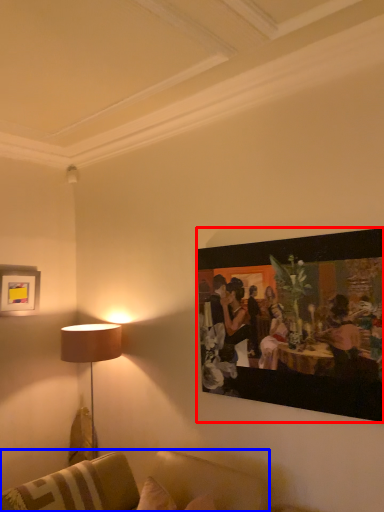
Question: Which object appears farthest to the camera in this image, picture frame (highlighted by a red box) or studio couch (highlighted by a blue box)?

Choices:
 (A) picture frame
 (B) studio couch

Answer: (A)